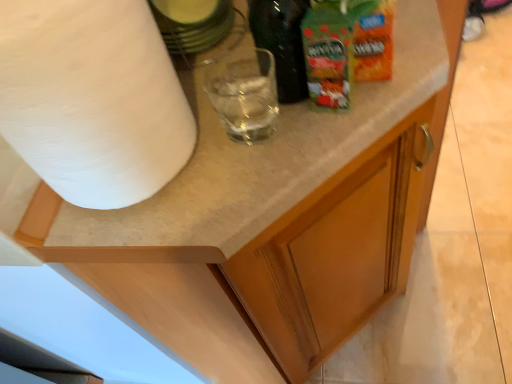
The width and height of the screenshot is (512, 384). What are the coordinates of `vacant space to the right of white matte paper towel at upper left` in the screenshot? It's located at (265, 128).